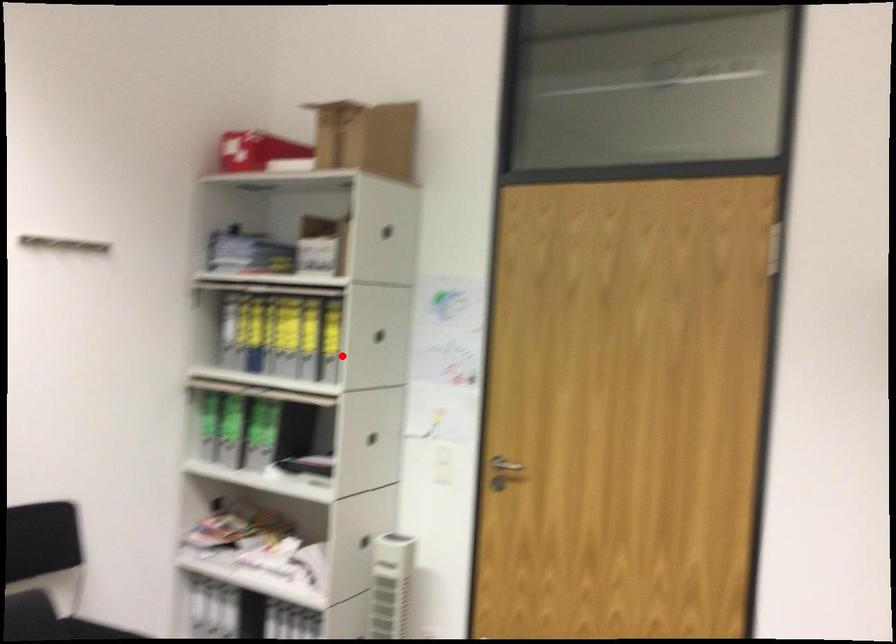
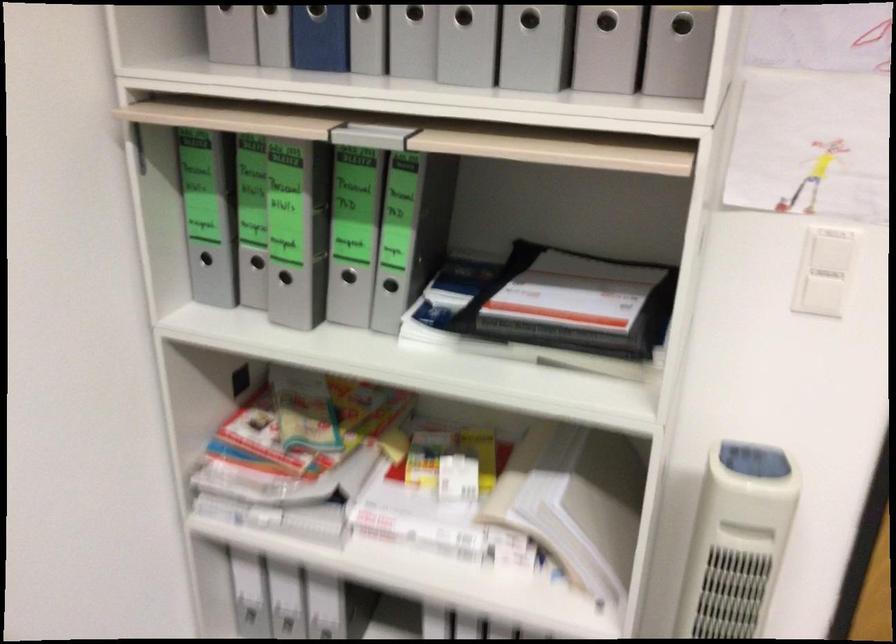
Question: I am providing you with two images of the same scene from different viewpoints. A red point is shown in image1. For the corresponding object point in image2, is it positioned nearer or farther from the camera?

Choices:
 (A) Nearer
 (B) Farther

Answer: (A)